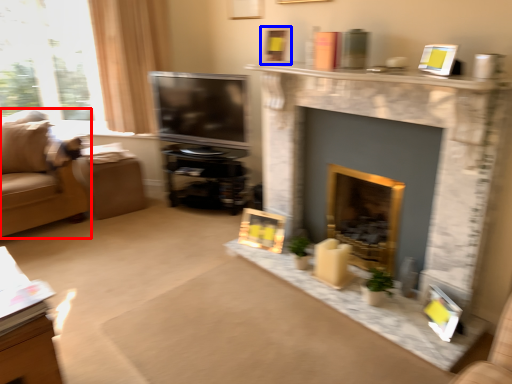
Question: Which object appears farthest to the camera in this image, studio couch (highlighted by a red box) or picture frame (highlighted by a blue box)?

Choices:
 (A) studio couch
 (B) picture frame

Answer: (A)